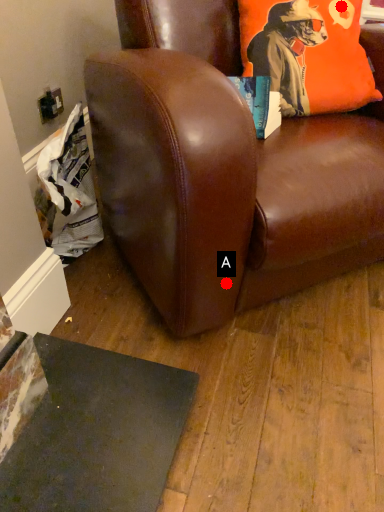
Question: Two points are circled on the image, labeled by A and B beside each circle. Which of the following is the farthest from the observer?

Choices:
 (A) A is further
 (B) B is further

Answer: (B)